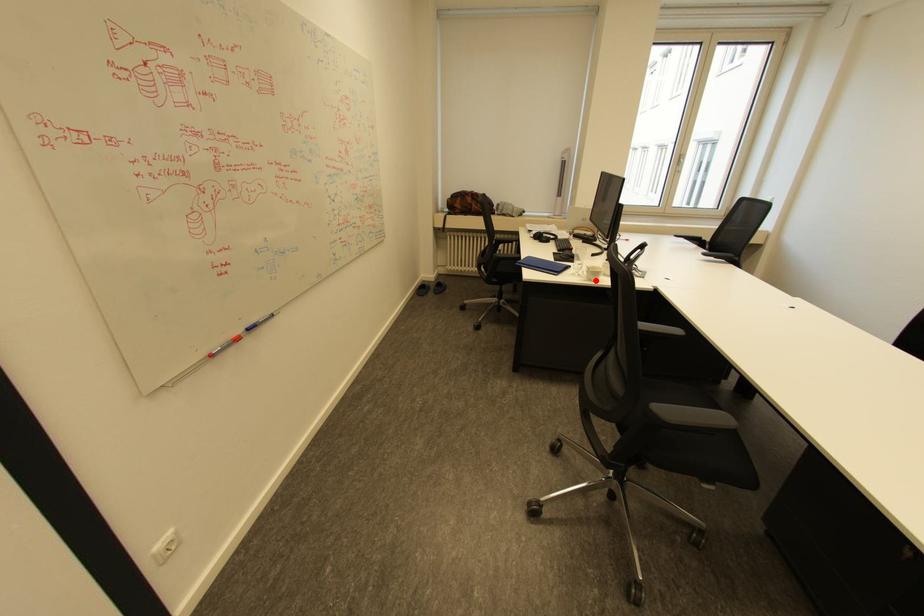
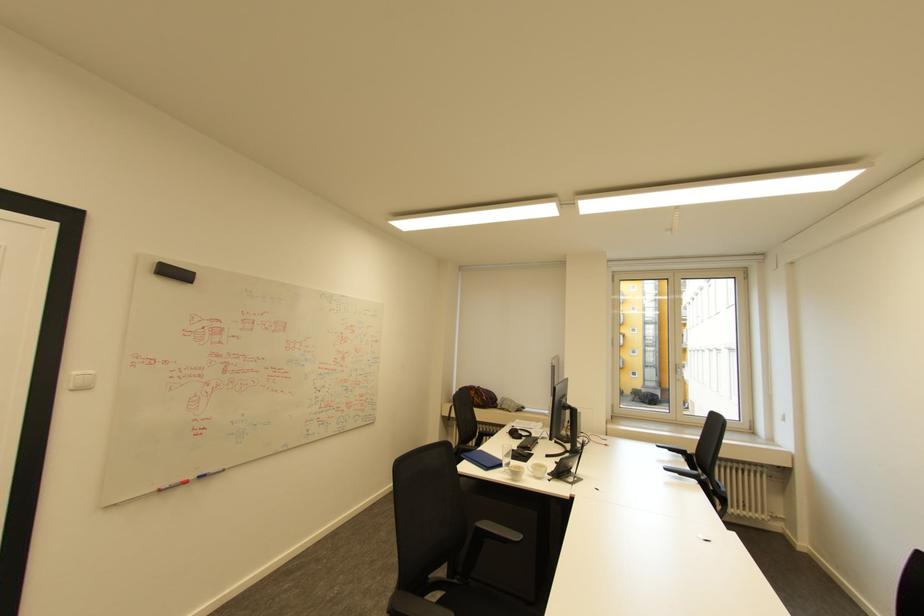
Question: I am providing you with two images of the same scene from different viewpoints. A red point is marked on the first image. At the location where the point appears in image 1, is it still visible in image 2?

Choices:
 (A) Yes
 (B) No

Answer: (A)